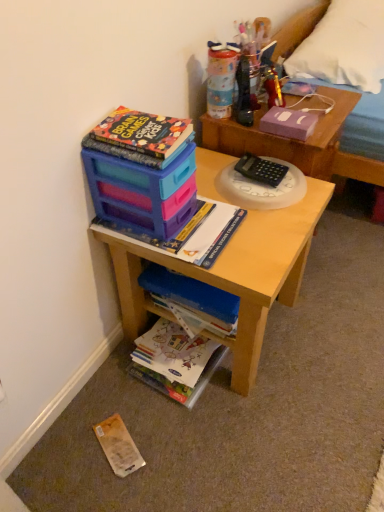
You are a GUI agent. You are given a task and a screenshot of the screen. Output one action in this format:
    pyautogui.click(x=<x>, y=<y>)
    Task: Click on the vacant space to the right of matte plastic desk at center
    
    Given the screenshot: What is the action you would take?
    pyautogui.click(x=331, y=322)